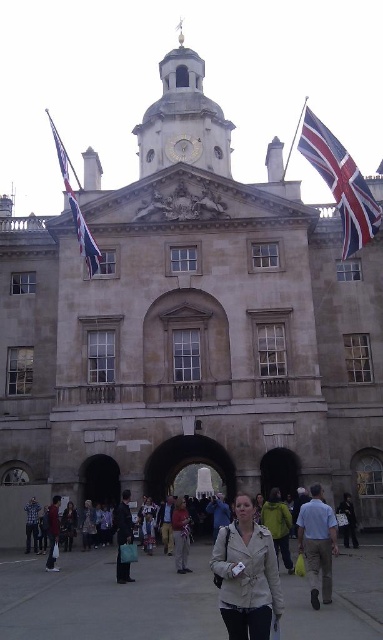
Which is in front, point (325, 563) or point (80, 236)?

Point (325, 563) is in front.

Find the location of a particular element. This screenshot has height=640, width=383. light beige shirt at center is located at coordinates (317, 544).

Between point (327, 177) and point (70, 195), which one is positioned in front?

Positioned in front is point (70, 195).

Who is shorter, red fabric flag at upper right or red-white striped flag at upper left?

red fabric flag at upper right

The height and width of the screenshot is (640, 383). What do you see at coordinates (340, 182) in the screenshot? I see `red fabric flag at upper right` at bounding box center [340, 182].

Identify the location of red fabric flag at upper right. (340, 182).

Is red-white striped flag at upper left thinner than denim jacket at lower left?

In fact, red-white striped flag at upper left might be wider than denim jacket at lower left.

Which is more to the left, red-white striped flag at upper left or denim jacket at lower left?

Positioned to the left is red-white striped flag at upper left.

Does point (91, 266) come closer to viewer compared to point (36, 516)?

That is False.

You are a GUI agent. You are given a task and a screenshot of the screen. Output one action in this format:
    pyautogui.click(x=<x>, y=<y>)
    Task: Click on the red-white striped flag at upper left
    
    Given the screenshot: What is the action you would take?
    pyautogui.click(x=75, y=205)